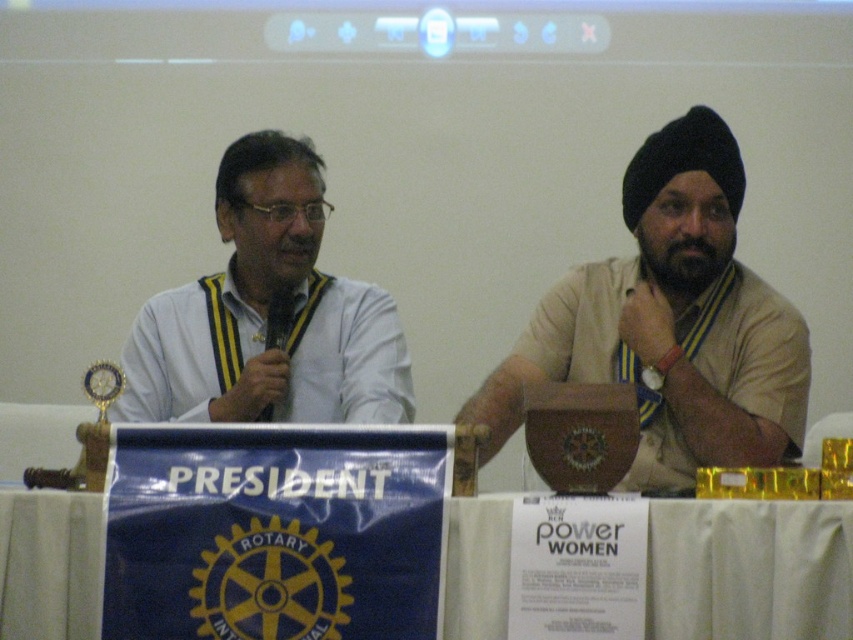
Question: Does white cloth at lower center have a lesser width compared to white matte shirt at left?

Choices:
 (A) no
 (B) yes

Answer: (B)

Question: Can you confirm if beige fabric shirt at right is positioned to the right of white cloth at lower center?

Choices:
 (A) yes
 (B) no

Answer: (B)

Question: Which point is closer to the camera?

Choices:
 (A) (697, 534)
 (B) (264, 372)

Answer: (A)

Question: Can you confirm if beige fabric shirt at right is smaller than white matte shirt at left?

Choices:
 (A) no
 (B) yes

Answer: (A)

Question: Which point appears closest to the camera in this image?

Choices:
 (A) coord(584,269)
 (B) coord(357,369)
 (C) coord(467,536)

Answer: (C)

Question: Which point is farther from the camera taking this photo?

Choices:
 (A) (738, 148)
 (B) (54, 572)

Answer: (A)